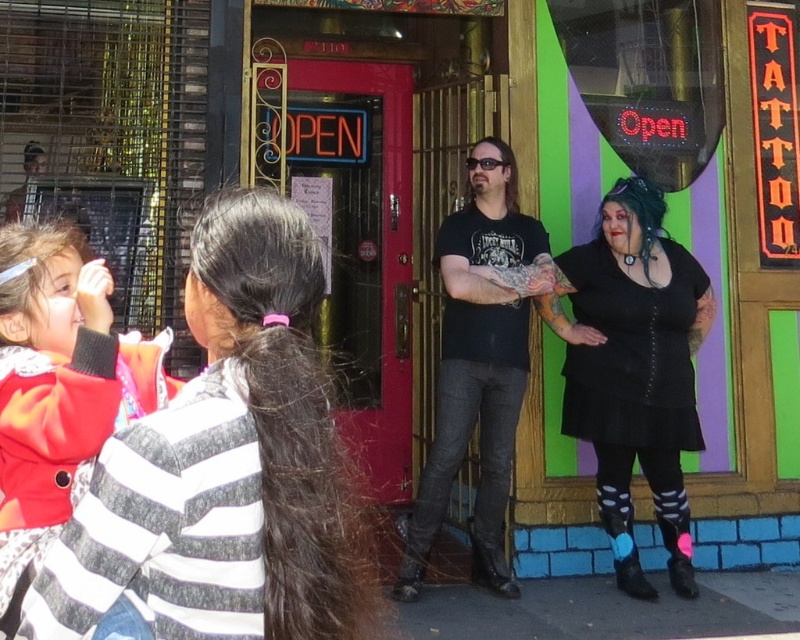
Question: Where is black textured dress at center located in relation to matte red jacket at left in the image?

Choices:
 (A) above
 (B) below

Answer: (B)

Question: Estimate the real-world distances between objects in this image. Which object is closer to the black textured dress at center?

Choices:
 (A) matte red jacket at left
 (B) black matte t-shirt at center

Answer: (B)

Question: Does black textured dress at center appear under matte red jacket at left?

Choices:
 (A) no
 (B) yes

Answer: (B)

Question: Can you confirm if black textured dress at center is positioned to the left of black matte t-shirt at center?

Choices:
 (A) no
 (B) yes

Answer: (A)

Question: Among these objects, which one is nearest to the camera?

Choices:
 (A) black matte t-shirt at center
 (B) matte red jacket at left
 (C) black textured dress at center
 (D) striped sweater at center

Answer: (D)

Question: Which object is closer to the camera taking this photo?

Choices:
 (A) striped sweater at center
 (B) matte red jacket at left

Answer: (A)